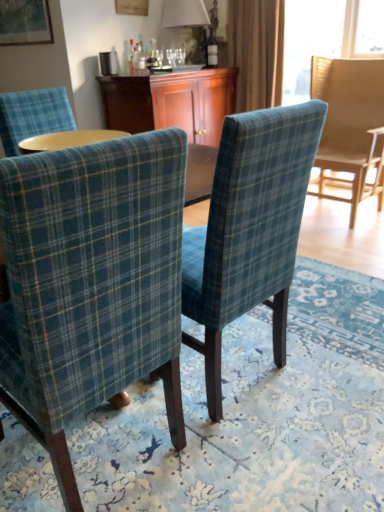
I want to click on vacant space in front of teal plaid chair at right, which is counted as the third chair, starting from the front, so click(343, 237).